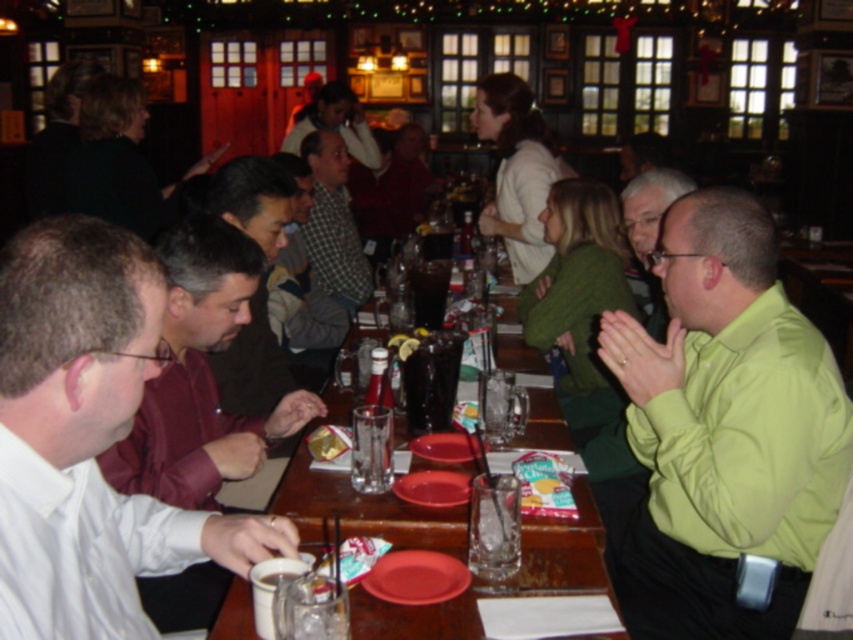
You are standing in the restaurant and see the point marked at coordinates (90, 436). What object or feature is located at that point?

The point at coordinates (90, 436) marks the white shirt at left.

Looking at this image, you are a server carrying a tray of drinks and need to place them on the wooden table at center. However, you notice the green checkered shirt at center is in the way. Can you place the drinks on the table without moving the shirt?

The wooden table at center has a lesser height compared to green checkered shirt at center, so the shirt might be blocking access to the table. To place the drinks safely, you should move the green checkered shirt at center out of the way first.